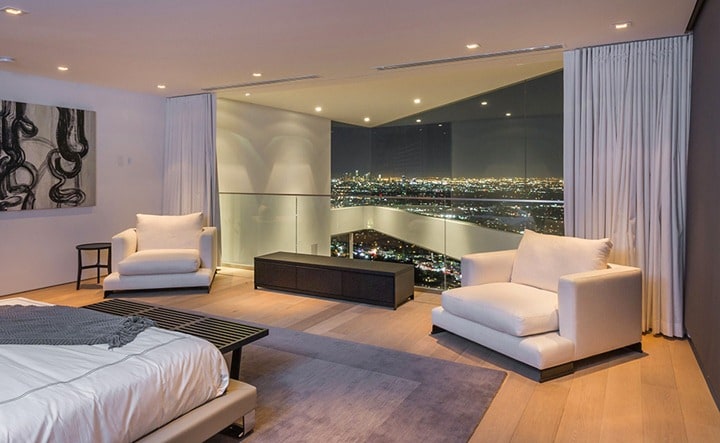
The width and height of the screenshot is (720, 443). I want to click on bed, so click(127, 372).